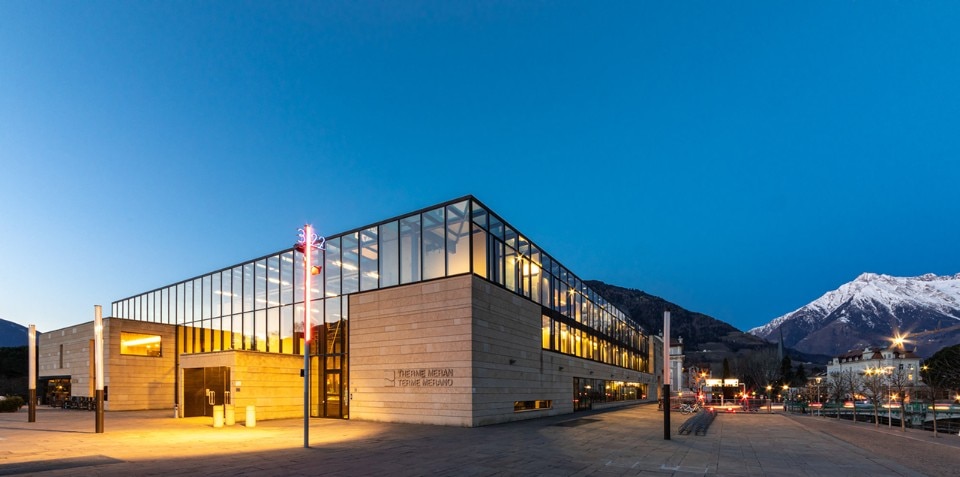
In order to click on glowing pink colored lights in this screenshot , I will do (305, 305), (94, 383), (36, 371), (669, 371), (707, 404), (745, 404).